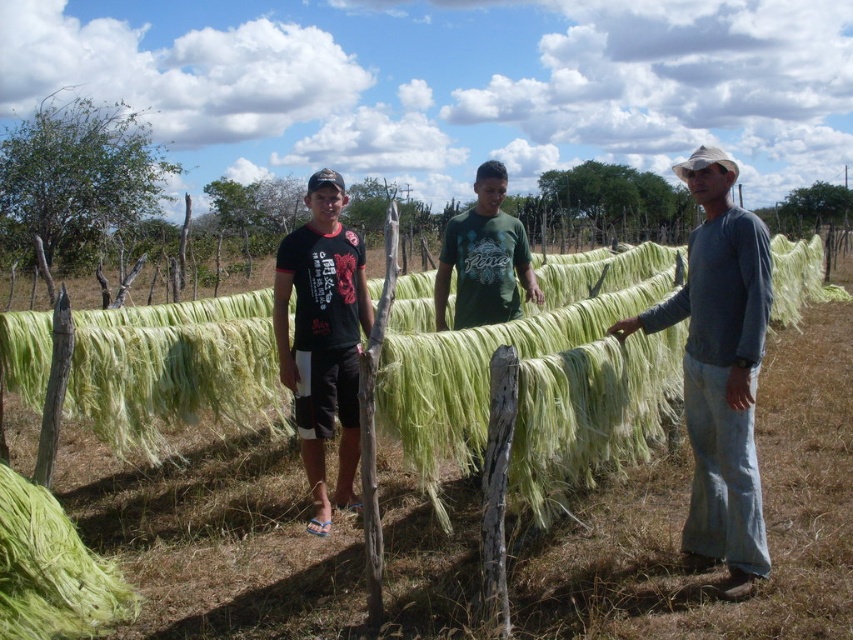
Question: Does green leafy tree at left appear on the right side of green matte shirt at center?

Choices:
 (A) no
 (B) yes

Answer: (A)

Question: Which of the following is the farthest from the observer?

Choices:
 (A) green leafy tree at upper center
 (B) green fibrous hay at lower left
 (C) green leafy tree at left

Answer: (A)

Question: Which point is closer to the camera?

Choices:
 (A) green matte shirt at center
 (B) light blue denim jeans at right
 (C) green leafy tree at upper center

Answer: (B)

Question: Does green leafy tree at upper center appear on the left side of green leafy plant at upper center?

Choices:
 (A) yes
 (B) no

Answer: (A)

Question: Which point appears farthest from the camera in this image?

Choices:
 (A) tap(805, 196)
 (B) tap(12, 148)

Answer: (A)

Question: Does black matte t-shirt at center appear on the left side of green fibrous hay at lower left?

Choices:
 (A) no
 (B) yes

Answer: (A)